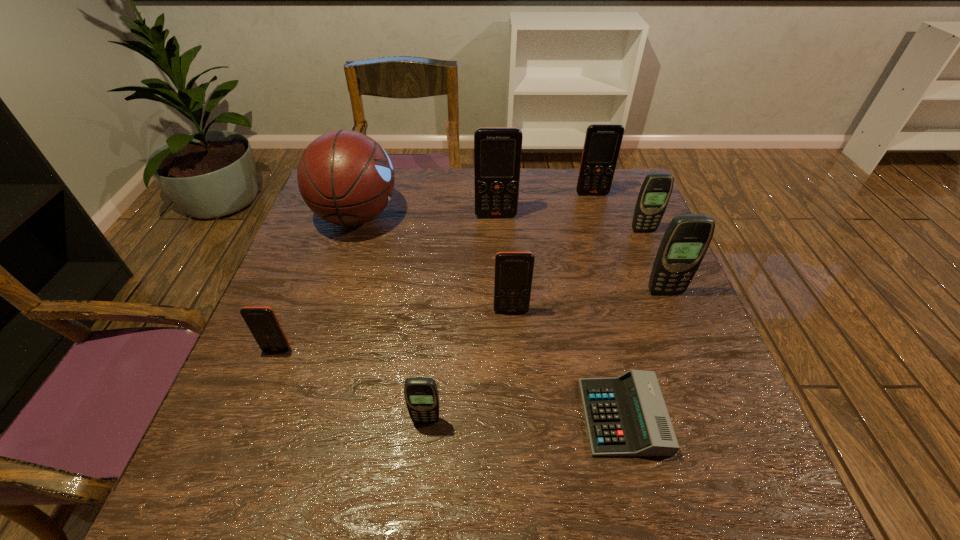
Find the location of a particular element. Image resolution: width=960 pixels, height=540 pixels. cellular telephone that can be found as the third closest to the biggest orange cellular telephone is located at coordinates (513, 277).

You are a GUI agent. You are given a task and a screenshot of the screen. Output one action in this format:
    pyautogui.click(x=<x>, y=<y>)
    Task: Click on the cellular telephone that is the second nearest to the nearest orange cellular telephone
    The image size is (960, 540).
    Given the screenshot: What is the action you would take?
    pyautogui.click(x=513, y=277)

Identify the location of the second closest orange cellular telephone to the biggest gray cellular telephone. Image resolution: width=960 pixels, height=540 pixels. (602, 143).

Choose which orange cellular telephone is the second nearest neighbor to the shortest object. Please provide its 2D coordinates. Your answer should be formatted as a tuple, i.e. [(x, y)], where the tuple contains the x and y coordinates of a point satisfying the conditions above.

[(497, 150)]

Locate which gray cellular telephone ranks in proximity to the basketball. Please provide its 2D coordinates. Your answer should be formatted as a tuple, i.e. [(x, y)], where the tuple contains the x and y coordinates of a point satisfying the conditions above.

[(421, 395)]

Image resolution: width=960 pixels, height=540 pixels. Identify the location of the second closest gray cellular telephone to the second farthest gray cellular telephone. (421, 395).